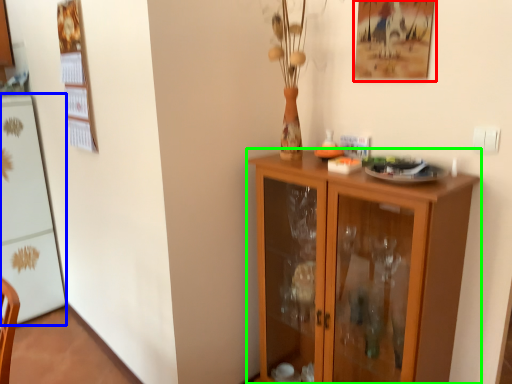
Question: Which is nearer to the picture frame (highlighted by a red box)? appliance (highlighted by a blue box) or cupboard (highlighted by a green box).

Choices:
 (A) appliance
 (B) cupboard

Answer: (B)